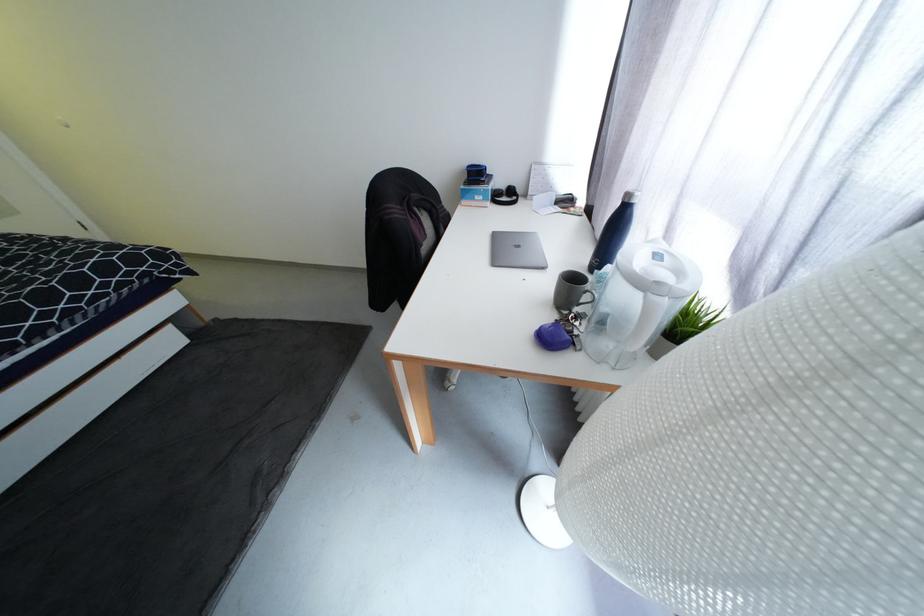
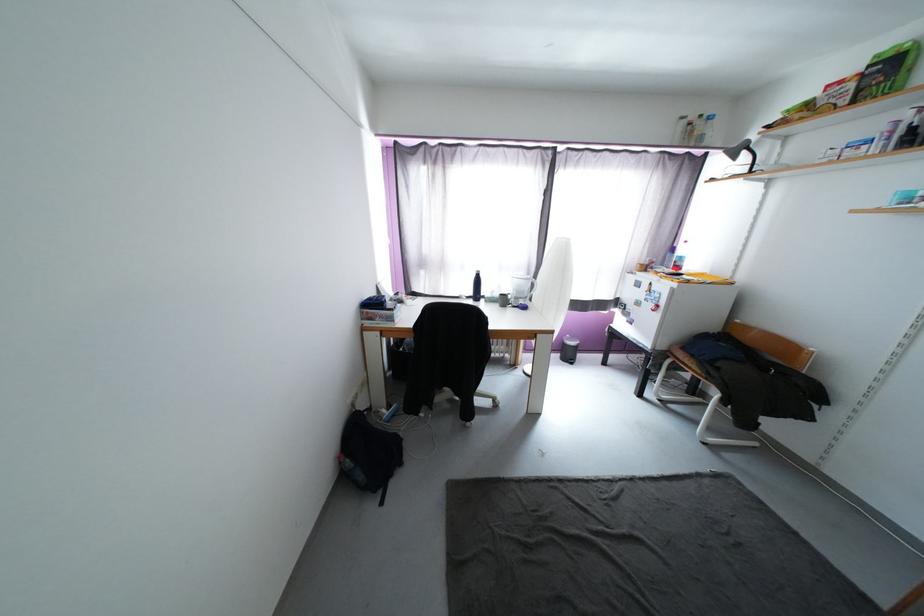
Question: I am providing you with two images of the same scene from different viewpoints. Please identify which objects are invisible in image2.

Choices:
 (A) small trash bin
 (B) black desk lamp
 (C) black headphones
 (D) black fabric bag

Answer: (C)